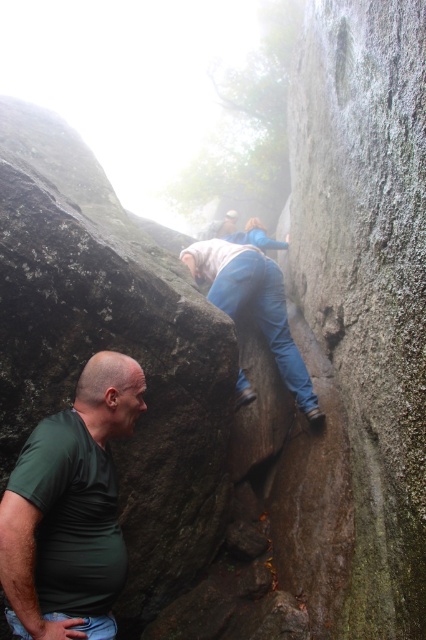
Can you confirm if green matte shirt at lower left is taller than blue jeans at center?

No, green matte shirt at lower left is not taller than blue jeans at center.

Which of these two, green matte shirt at lower left or blue jeans at center, stands shorter?

green matte shirt at lower left is shorter.

This screenshot has height=640, width=426. What do you see at coordinates (69, 506) in the screenshot? I see `green matte shirt at lower left` at bounding box center [69, 506].

This screenshot has width=426, height=640. Find the location of `green matte shirt at lower left`. green matte shirt at lower left is located at coordinates (69, 506).